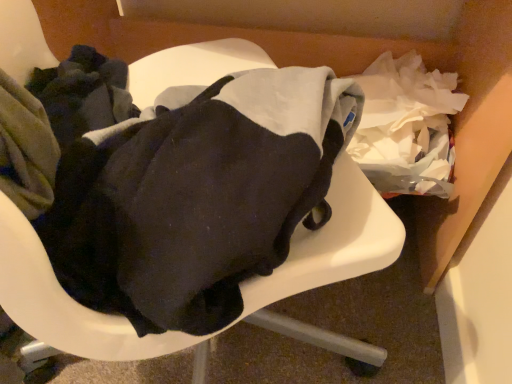
This screenshot has height=384, width=512. What do you see at coordinates (362, 69) in the screenshot? I see `white cardboard box at center` at bounding box center [362, 69].

The width and height of the screenshot is (512, 384). I want to click on white cardboard box at center, so click(x=362, y=69).

Consider the image. Measure the distance between point (153,38) and camera.

The distance of point (153,38) from camera is 37.48 inches.

The height and width of the screenshot is (384, 512). What are the coordinates of `white cardboard box at center` in the screenshot? It's located at (362, 69).